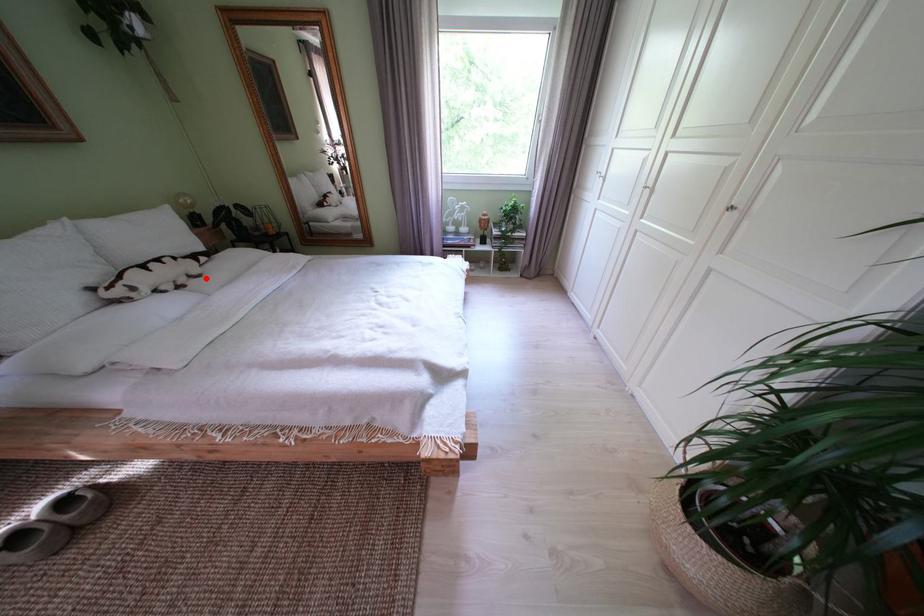
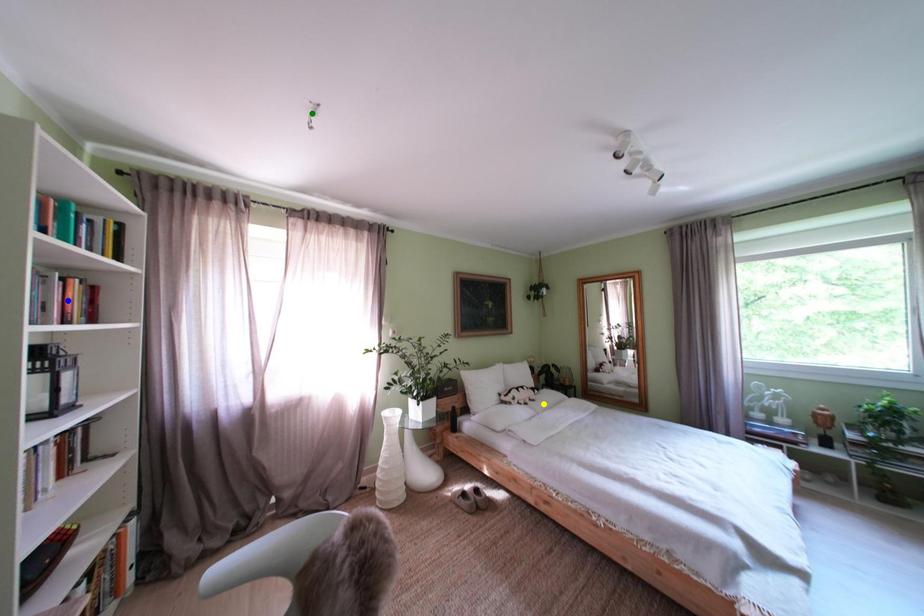
Question: I am providing you with two images of the same scene from different viewpoints. A red point is marked on the first image. You are given multiple points on the second image. In image 2, which mark is for the same physical point as the one in image 1?

Choices:
 (A) yellow point
 (B) blue point
 (C) green point

Answer: (A)